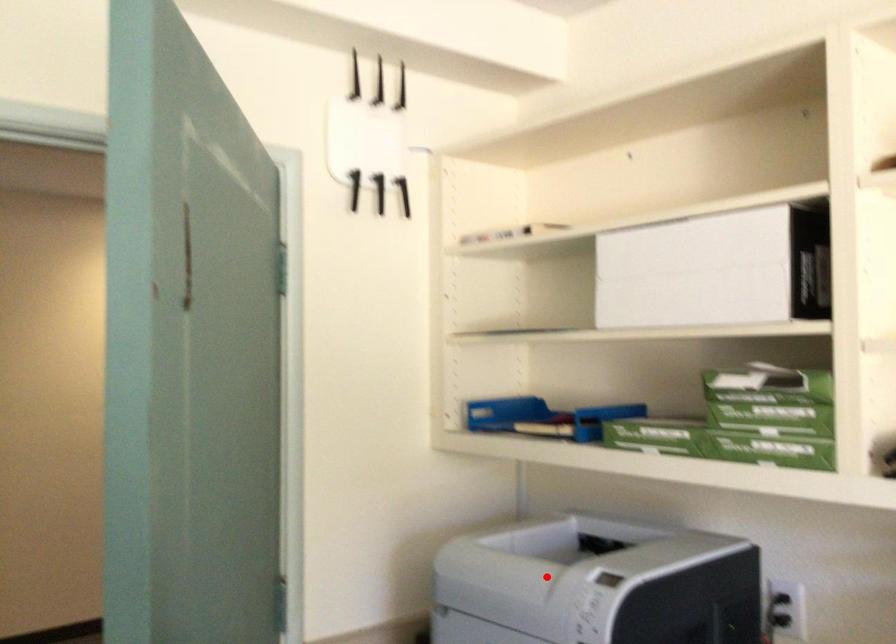
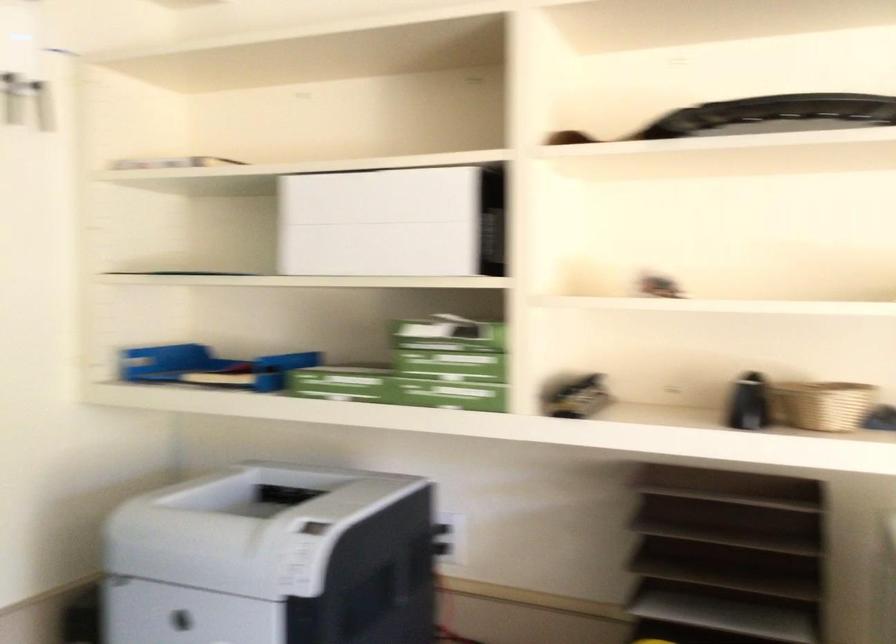
Find the pixel in the second image that matches the highlighted location in the first image.

(246, 527)